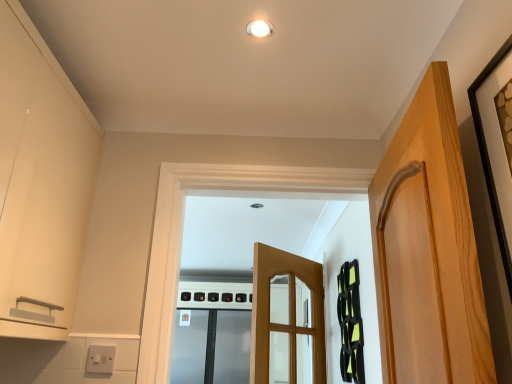
This screenshot has height=384, width=512. What are the coordinates of `light brown wooden door at center, positioned as the first door in back-to-front order` in the screenshot? It's located at (285, 313).

The image size is (512, 384). In order to click on light wood door at right, marked as the first door in a front-to-back arrangement in this screenshot , I will do 428,250.

This screenshot has width=512, height=384. What do you see at coordinates (100, 359) in the screenshot?
I see `white plastic switch at lower left` at bounding box center [100, 359].

Find the location of `matte white cabinet at left`. matte white cabinet at left is located at coordinates (40, 182).

Does point (229, 373) come farther from viewer compared to point (494, 187)?

Yes, it is behind point (494, 187).

Is the surface of stainless steel refrigerator at center in direct contact with black matte picture frame at upper right?

No, stainless steel refrigerator at center is not with black matte picture frame at upper right.

Does stainless steel refrigerator at center have a lesser width compared to black matte picture frame at upper right?

Incorrect, the width of stainless steel refrigerator at center is not less than that of black matte picture frame at upper right.

The width and height of the screenshot is (512, 384). Identify the location of screen door below the black matte picture frame at upper right (from the image's perspective). (212, 347).

Which of these two, black matte picture frame at upper right or white glossy light fixture at upper center, is smaller?

white glossy light fixture at upper center.

Which object is closer to the camera taking this photo, black matte picture frame at upper right or white glossy light fixture at upper center?

black matte picture frame at upper right.

How far apart are black matte picture frame at upper right and white glossy light fixture at upper center?

27.25 inches.

Is black matte picture frame at upper right to the left of white glossy light fixture at upper center from the viewer's perspective?

No, black matte picture frame at upper right is not to the left of white glossy light fixture at upper center.

From the image's perspective, which object appears higher, light brown wooden door at center, the 2th door positioned from the front, or white glossy light fixture at upper center?

white glossy light fixture at upper center appears higher in the image.

The width and height of the screenshot is (512, 384). Identify the location of the 2nd door below the white glossy light fixture at upper center (from a real-world perspective). (285, 313).

From the picture: From a real-world perspective, does light brown wooden door at center, positioned as the first door in back-to-front order, stand above white glossy light fixture at upper center?

No.

How far apart are light brown wooden door at center, positioned as the first door in back-to-front order, and white glossy light fixture at upper center?

light brown wooden door at center, positioned as the first door in back-to-front order, and white glossy light fixture at upper center are 1.80 meters apart from each other.

Considering the sizes of objects white plastic switch at lower left and light wood door at right, marked as the first door in a front-to-back arrangement, in the image provided, who is wider, white plastic switch at lower left or light wood door at right, marked as the first door in a front-to-back arrangement,?

Wider between the two is light wood door at right, marked as the first door in a front-to-back arrangement.

How much distance is there between white plastic switch at lower left and light wood door at right, the second door in the back-to-front sequence?

white plastic switch at lower left and light wood door at right, the second door in the back-to-front sequence, are 3.37 feet apart.

Which is nearer, (102, 358) or (420, 371)?

Point (102, 358).

Is white plastic switch at lower left turned away from light wood door at right, marked as the first door in a front-to-back arrangement?

Result: No, white plastic switch at lower left's orientation is not away from light wood door at right, marked as the first door in a front-to-back arrangement.

Does black matte picture frame at upper right appear on the right side of stainless steel refrigerator at center?

Indeed, black matte picture frame at upper right is positioned on the right side of stainless steel refrigerator at center.

From the image's perspective, is black matte picture frame at upper right located above stainless steel refrigerator at center?

Indeed, from the image's perspective, black matte picture frame at upper right is shown above stainless steel refrigerator at center.

Is black matte picture frame at upper right surrounding stainless steel refrigerator at center?

Definitely not — stainless steel refrigerator at center is not inside black matte picture frame at upper right.

Is point (95, 360) closer to viewer compared to point (228, 314)?

Yes, point (95, 360) is in front of point (228, 314).

Considering the relative positions of white plastic switch at lower left and stainless steel refrigerator at center in the image provided, is white plastic switch at lower left in front of stainless steel refrigerator at center?

Yes, white plastic switch at lower left is closer to the viewer.

Which object is positioned more to the right, white plastic switch at lower left or stainless steel refrigerator at center?

From the viewer's perspective, stainless steel refrigerator at center appears more on the right side.

Is black matte picture frame at upper right turned away from light brown wooden door at center, the 2th door positioned from the front?

No.

Can you confirm if black matte picture frame at upper right is positioned to the right of light brown wooden door at center, positioned as the first door in back-to-front order?

Yes.

Does black matte picture frame at upper right have a smaller size compared to light brown wooden door at center, the 2th door positioned from the front?

Yes.

From the picture: Is black matte picture frame at upper right outside of light brown wooden door at center, positioned as the first door in back-to-front order?

Yes, black matte picture frame at upper right is located beyond the bounds of light brown wooden door at center, positioned as the first door in back-to-front order.

This screenshot has width=512, height=384. I want to click on screen door located underneath the black matte picture frame at upper right (from a real-world perspective), so coord(212,347).

Identify the location of light fixture above the black matte picture frame at upper right (from a real-world perspective). The height and width of the screenshot is (384, 512). (260, 28).

From the image, which object appears to be farther from black matte picture frame at upper right, white glossy light fixture at upper center or light brown wooden door at center, the 2th door positioned from the front?

Based on the image, light brown wooden door at center, the 2th door positioned from the front, appears to be further to black matte picture frame at upper right.

Which object lies further to the anchor point black matte picture frame at upper right, matte white cabinet at left or white plastic switch at lower left?

The object further to black matte picture frame at upper right is white plastic switch at lower left.

Looking at the image, which one is located further to white glossy light fixture at upper center, stainless steel refrigerator at center or light wood door at right, marked as the first door in a front-to-back arrangement?

stainless steel refrigerator at center.

Considering their positions, is light wood door at right, marked as the first door in a front-to-back arrangement, positioned closer to black matte picture frame at upper right than matte white cabinet at left?

Based on the image, light wood door at right, marked as the first door in a front-to-back arrangement, appears to be nearer to black matte picture frame at upper right.

Considering their positions, is light brown wooden door at center, positioned as the first door in back-to-front order, positioned further to light wood door at right, the second door in the back-to-front sequence, than white plastic switch at lower left?

Based on the image, light brown wooden door at center, positioned as the first door in back-to-front order, appears to be further to light wood door at right, the second door in the back-to-front sequence.

Consider the image. Which object lies nearer to the anchor point white glossy light fixture at upper center, light brown wooden door at center, the 2th door positioned from the front, or light wood door at right, the second door in the back-to-front sequence?

The object closer to white glossy light fixture at upper center is light wood door at right, the second door in the back-to-front sequence.

Considering their positions, is light wood door at right, marked as the first door in a front-to-back arrangement, positioned further to stainless steel refrigerator at center than black matte picture frame at upper right?

Based on the image, black matte picture frame at upper right appears to be further to stainless steel refrigerator at center.

When comparing their distances from matte white cabinet at left, does white plastic switch at lower left or light wood door at right, marked as the first door in a front-to-back arrangement, seem further?

light wood door at right, marked as the first door in a front-to-back arrangement, is positioned further to the anchor matte white cabinet at left.

The width and height of the screenshot is (512, 384). Find the location of `door located between white plastic switch at lower left and stainless steel refrigerator at center in the depth direction`. door located between white plastic switch at lower left and stainless steel refrigerator at center in the depth direction is located at coordinates (285, 313).

In order to click on electric outlet situated between matte white cabinet at left and black matte picture frame at upper right from left to right in this screenshot , I will do 100,359.

Find the location of `picture frame between white glossy light fixture at upper center and light wood door at right, marked as the first door in a front-to-back arrangement, from top to bottom`. picture frame between white glossy light fixture at upper center and light wood door at right, marked as the first door in a front-to-back arrangement, from top to bottom is located at coordinates (489, 159).

The width and height of the screenshot is (512, 384). Identify the location of light fixture positioned between light wood door at right, marked as the first door in a front-to-back arrangement, and stainless steel refrigerator at center from near to far. (260, 28).